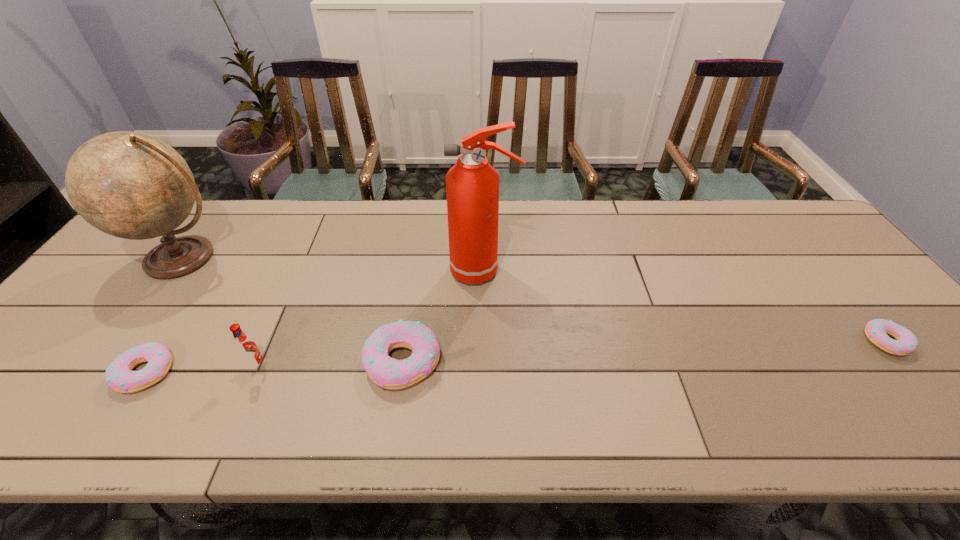
Identify the location of object present at the left edge. (130, 185).

At what (x,y) coordinates should I click in order to perform the action: click on object that is at the right edge. Please return your answer as a coordinate pair (x, y). Looking at the image, I should click on (876, 330).

Where is `object present at the far left corner`? The width and height of the screenshot is (960, 540). object present at the far left corner is located at coordinates (130, 185).

Identify the location of vacant space at the far edge of the desktop. (396, 237).

Where is `free space at the near edge`? This screenshot has width=960, height=540. free space at the near edge is located at coordinates (196, 396).

I want to click on vacant space at the far right corner, so click(779, 220).

This screenshot has height=540, width=960. What are the coordinates of `empty location between the fifth tallest object and the fourth object from right to left` in the screenshot? It's located at (201, 370).

Locate an element on the screen. vacant point located between the third tallest object and the fourth object from left to right is located at coordinates (330, 364).

Where is `free area in between the third tallest object and the globe`? free area in between the third tallest object and the globe is located at coordinates (221, 313).

In order to click on empty space between the globe and the third shortest object in this screenshot , I will do `click(293, 310)`.